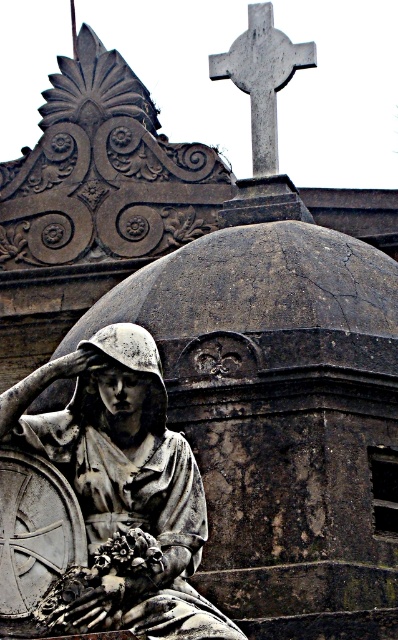
Question: Which point appears closest to the camera in this image?

Choices:
 (A) (271, 145)
 (B) (140, 346)

Answer: (B)

Question: Does matte gray statue at center have a greater width compared to gray stone cross at upper center?

Choices:
 (A) no
 (B) yes

Answer: (B)

Question: Does matte gray statue at center appear on the right side of gray stone cross at upper center?

Choices:
 (A) no
 (B) yes

Answer: (A)

Question: Does matte gray statue at center lie behind gray stone cross at upper center?

Choices:
 (A) yes
 (B) no

Answer: (B)